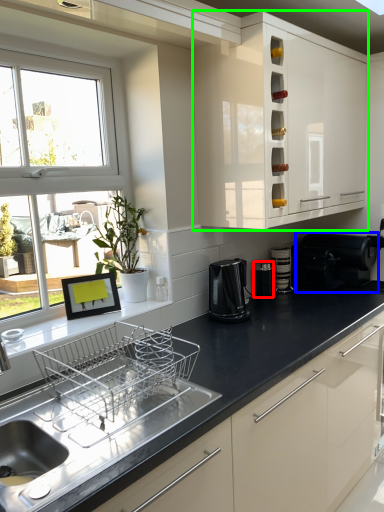
Question: Based on their relative distances, which object is farther from appliance (highlighted by a red box)? Choose from appliance (highlighted by a blue box) and cabinetry (highlighted by a green box).

Choices:
 (A) appliance
 (B) cabinetry

Answer: (B)